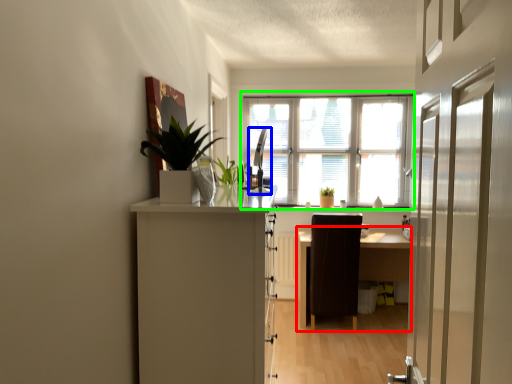
Question: Based on their relative distances, which object is farther from table (highlighted by a red box)? Choose from silver (highlighted by a blue box) and window (highlighted by a green box).

Choices:
 (A) silver
 (B) window

Answer: (A)